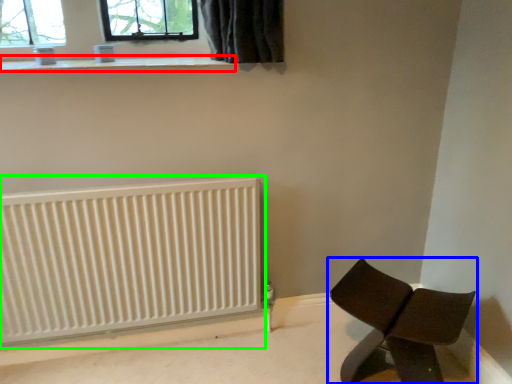
Question: Which is farther away from window sill (highlighted by a red box)? furniture (highlighted by a blue box) or radiator (highlighted by a green box)?

Choices:
 (A) furniture
 (B) radiator

Answer: (A)